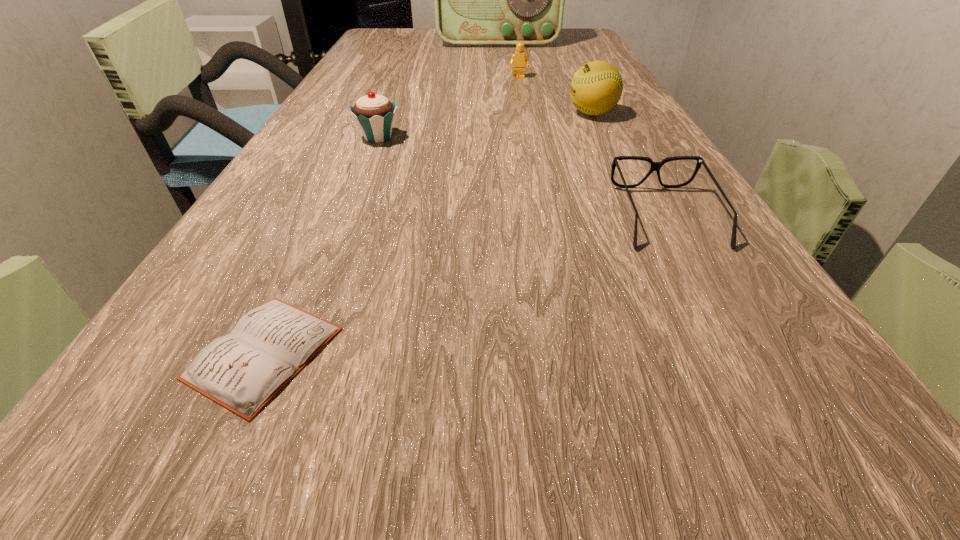
Identify the location of radio receiver. (479, 0).

What are the coordinates of `the tallest object` in the screenshot? It's located at (479, 0).

The width and height of the screenshot is (960, 540). What are the coordinates of `softball` in the screenshot? It's located at (596, 88).

This screenshot has width=960, height=540. What are the coordinates of `cupcake` in the screenshot? It's located at (374, 114).

The width and height of the screenshot is (960, 540). In order to click on Lego in this screenshot , I will do `click(519, 59)`.

The height and width of the screenshot is (540, 960). I want to click on the second shortest object, so click(x=655, y=166).

What are the coordinates of `spectacles` in the screenshot? It's located at (655, 166).

Where is `the nearest object`? The width and height of the screenshot is (960, 540). the nearest object is located at coordinates (241, 371).

Locate an element on the screen. diary is located at coordinates (241, 371).

Find the location of a particular element. vacant space positioned 0.320m on the front panel of the tallest object is located at coordinates (502, 84).